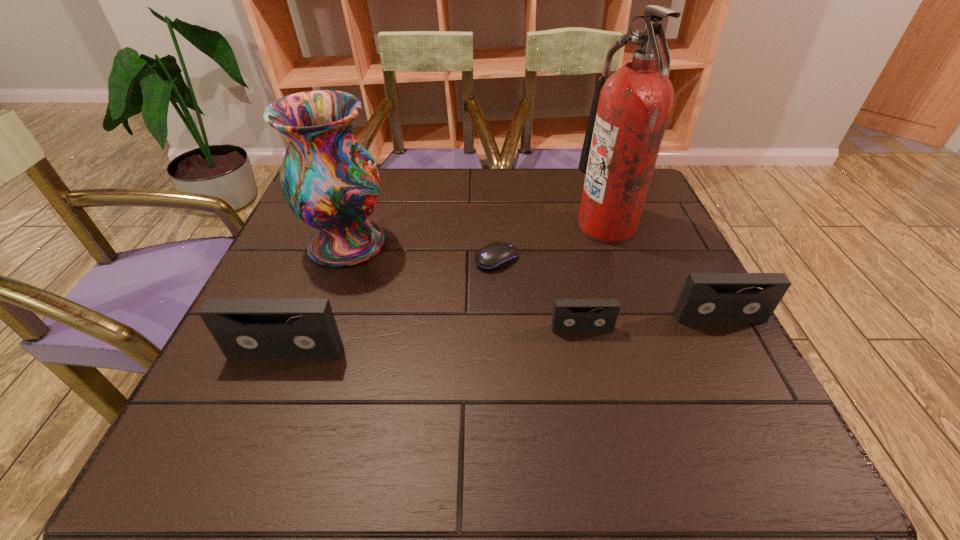
At what (x,y) coordinates should I click in order to perform the action: click on free location located on the front-facing side of the nearest object. Please return your answer as a coordinate pair (x, y). The height and width of the screenshot is (540, 960). Looking at the image, I should click on [268, 397].

The height and width of the screenshot is (540, 960). In order to click on free spot located 0.080m on the front-facing side of the fifth farthest object in this screenshot , I will do `click(589, 366)`.

The width and height of the screenshot is (960, 540). Find the location of `free space located on the front-facing side of the farthest videotape`. free space located on the front-facing side of the farthest videotape is located at coordinates (748, 373).

The image size is (960, 540). Identify the location of vacant region located 0.380m on the back of the fourth object from right to left. (492, 168).

Identify the location of vacant position located on the front of the fifth shortest object. (313, 341).

Where is `vacant space located on the front of the fire extinguisher near the operation label`? vacant space located on the front of the fire extinguisher near the operation label is located at coordinates (554, 226).

Identify the location of free point located 0.060m on the front of the fire extinguisher near the operation label. (554, 226).

The width and height of the screenshot is (960, 540). I want to click on vacant region located 0.130m on the front of the fire extinguisher near the operation label, so click(526, 226).

Locate an element on the screen. object present at the far edge is located at coordinates (630, 109).

In order to click on videotape at the left edge in this screenshot , I will do `click(244, 328)`.